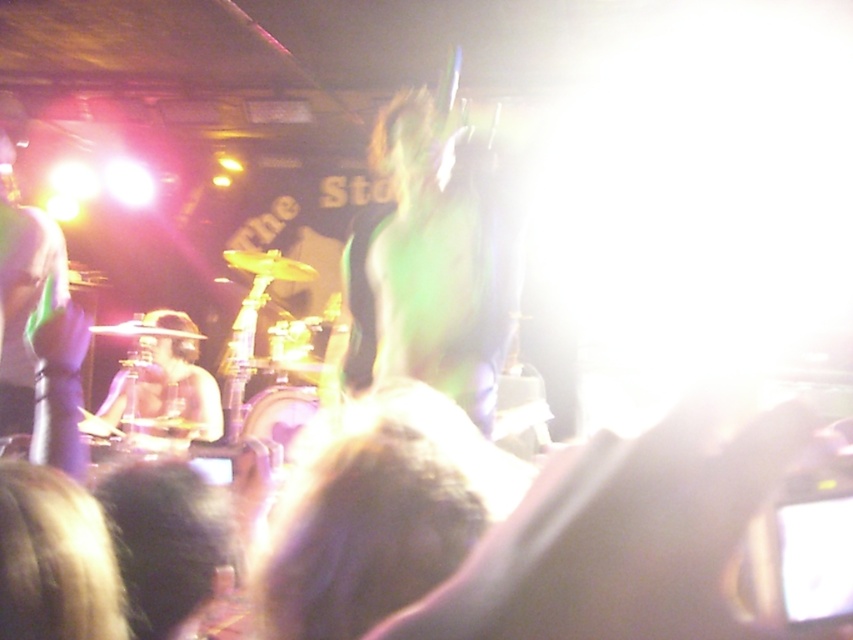
Describe the element at coordinates (432, 264) in the screenshot. This screenshot has width=853, height=640. I see `green matte hand at center` at that location.

Who is positioned more to the left, green matte hand at center or shiny purple shirt at left?

Positioned to the left is shiny purple shirt at left.

Is point (390, 250) in front of point (184, 312)?

Yes.

Locate an element on the screen. The width and height of the screenshot is (853, 640). green matte hand at center is located at coordinates (432, 264).